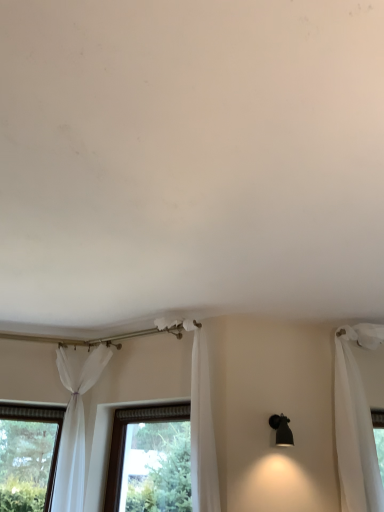
Question: Should I look upward or downward to see white sheer curtain at center, which is counted as the 2th curtain, starting from the left?

Choices:
 (A) down
 (B) up

Answer: (A)

Question: Does clear glass window at center have a larger size compared to white sheer curtain at center, which is counted as the 2th curtain, starting from the left?

Choices:
 (A) no
 (B) yes

Answer: (A)

Question: Is white sheer curtain at center, which is counted as the 2th curtain, starting from the left, at the back of clear glass window at center?

Choices:
 (A) yes
 (B) no

Answer: (B)

Question: Can you confirm if clear glass window at center is wider than white sheer curtain at center, which is counted as the 2th curtain, starting from the left?

Choices:
 (A) yes
 (B) no

Answer: (B)

Question: From a real-world perspective, is clear glass window at center beneath white sheer curtain at center, positioned as the 1th curtain in right-to-left order?

Choices:
 (A) no
 (B) yes

Answer: (B)

Question: From the image's perspective, does clear glass window at center appear lower than white sheer curtain at center, which is counted as the 2th curtain, starting from the left?

Choices:
 (A) yes
 (B) no

Answer: (A)

Question: From a real-world perspective, is clear glass window at center located higher than white sheer curtain at center, which is counted as the 2th curtain, starting from the left?

Choices:
 (A) no
 (B) yes

Answer: (A)

Question: Is white sheer curtain at center, positioned as the 1th curtain in right-to-left order, far away from clear glass window at center?

Choices:
 (A) yes
 (B) no

Answer: (B)

Question: Considering the relative sizes of white sheer curtain at center, which is counted as the 2th curtain, starting from the left, and clear glass window at center in the image provided, is white sheer curtain at center, which is counted as the 2th curtain, starting from the left, shorter than clear glass window at center?

Choices:
 (A) no
 (B) yes

Answer: (A)

Question: Does white sheer curtain at center, which is counted as the 2th curtain, starting from the left, have a larger size compared to clear glass window at center?

Choices:
 (A) yes
 (B) no

Answer: (A)

Question: Is white sheer curtain at center, positioned as the 1th curtain in right-to-left order, oriented away from clear glass window at center?

Choices:
 (A) no
 (B) yes

Answer: (A)

Question: Is white sheer curtain at center, which is counted as the 2th curtain, starting from the left, at the right side of clear glass window at center?

Choices:
 (A) no
 (B) yes

Answer: (B)

Question: Considering the relative sizes of white sheer curtain at center, which is counted as the 2th curtain, starting from the left, and clear glass window at center in the image provided, is white sheer curtain at center, which is counted as the 2th curtain, starting from the left, smaller than clear glass window at center?

Choices:
 (A) yes
 (B) no

Answer: (B)

Question: From a real-world perspective, is white sheer curtain at center, positioned as the 1th curtain in right-to-left order, beneath sheer white curtain at lower left, arranged as the 2th curtain when viewed from the right?

Choices:
 (A) yes
 (B) no

Answer: (B)